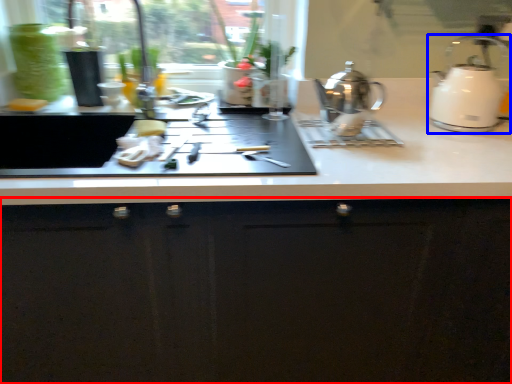
Question: Among these objects, which one is nearest to the camera, cabinetry (highlighted by a red box) or kettle (highlighted by a blue box)?

Choices:
 (A) cabinetry
 (B) kettle

Answer: (A)